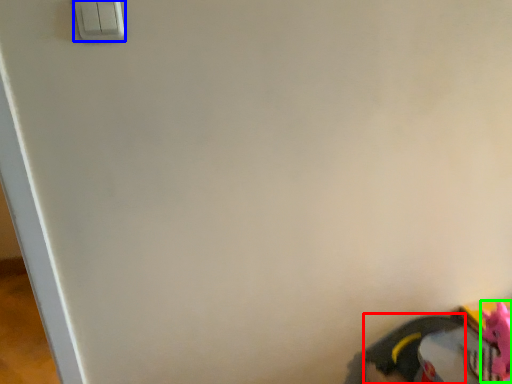
Question: Estimate the real-world distances between objects in this image. Which object is farther from footwear (highlighted by a red box), light switch (highlighted by a blue box) or toy (highlighted by a green box)?

Choices:
 (A) light switch
 (B) toy

Answer: (A)